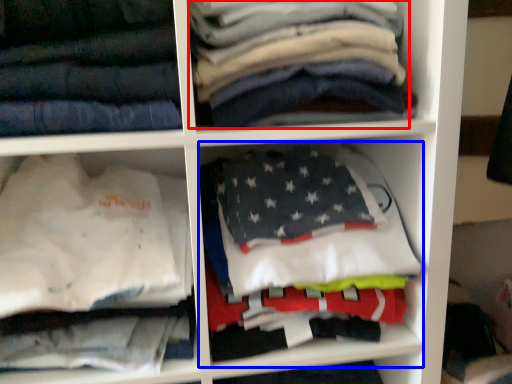
Question: Which of the following is the closest to the observer, clothing (highlighted by a red box) or cabinet (highlighted by a blue box)?

Choices:
 (A) clothing
 (B) cabinet

Answer: (A)